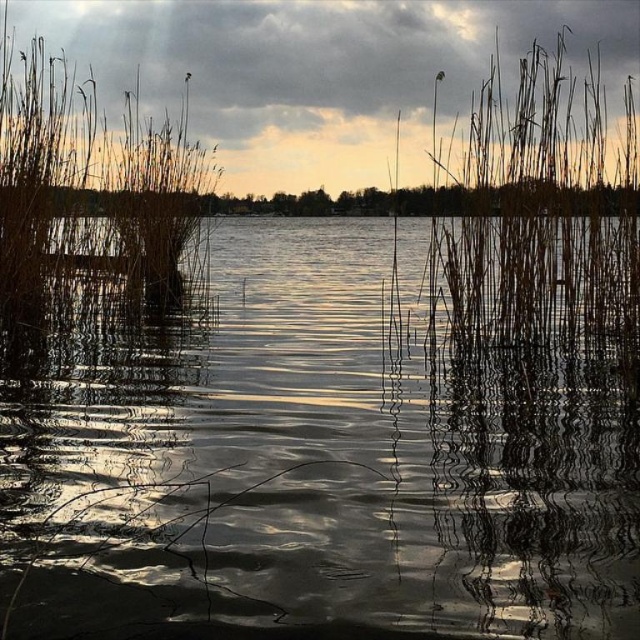
Question: Which point is closer to the camera?

Choices:
 (A) (413, 358)
 (B) (19, 20)
 (C) (64, 243)
 (D) (560, 168)

Answer: (A)

Question: Is cloudy sky at upper center smaller than brown dry reed at right?

Choices:
 (A) no
 (B) yes

Answer: (A)

Question: Considering the real-world distances, which object is farthest from the cloudy sky at upper center?

Choices:
 (A) brown reeds at left
 (B) brown dry reed at right

Answer: (B)

Question: Which of the following is the farthest from the observer?

Choices:
 (A) glistening water at center
 (B) brown reeds at left
 (C) brown dry reed at right
 (D) cloudy sky at upper center

Answer: (C)

Question: Does glistening water at center appear under cloudy sky at upper center?

Choices:
 (A) yes
 (B) no

Answer: (A)

Question: Is glistening water at center smaller than brown dry reed at right?

Choices:
 (A) yes
 (B) no

Answer: (B)